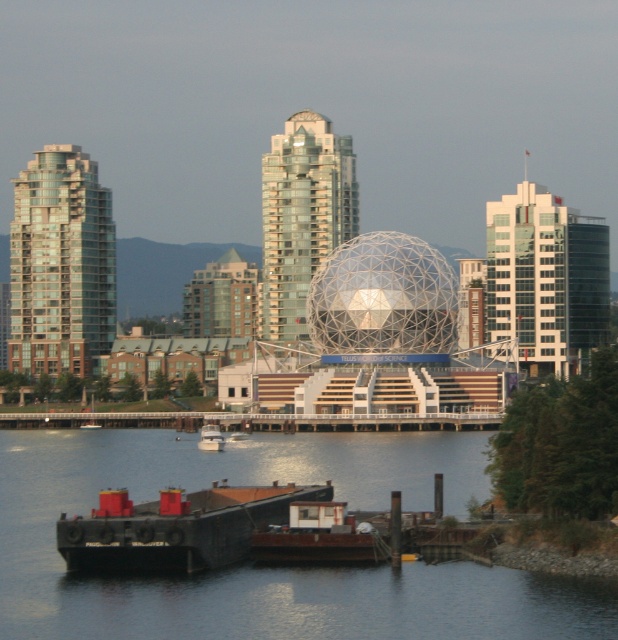
Who is more distant from viewer, (402,344) or (258,548)?

Positioned behind is point (402,344).

Does transparent glass dome at center have a smaller size compared to rustic wood boat at lower center?

Incorrect, transparent glass dome at center is not smaller in size than rustic wood boat at lower center.

This screenshot has width=618, height=640. I want to click on transparent glass dome at center, so click(383, 298).

Between dark blue water at lower center and rustic wood boat at lower center, which one has more height?

Standing taller between the two is dark blue water at lower center.

Which is more to the right, dark blue water at lower center or rustic wood boat at lower center?

rustic wood boat at lower center is more to the right.

Is point (509, 621) positioned in front of point (305, 516)?

Yes, it is.

Locate an element on the screen. This screenshot has height=640, width=618. dark blue water at lower center is located at coordinates (268, 566).

Is dark gray metal barge at lower left to the left of white glossy boat at lower left from the viewer's perspective?

No, dark gray metal barge at lower left is not to the left of white glossy boat at lower left.

Can you confirm if dark gray metal barge at lower left is positioned below white glossy boat at lower left?

Yes, dark gray metal barge at lower left is below white glossy boat at lower left.

Find the location of a particular element. dark gray metal barge at lower left is located at coordinates (176, 529).

What are the coordinates of `dark gray metal barge at lower left` in the screenshot? It's located at (176, 529).